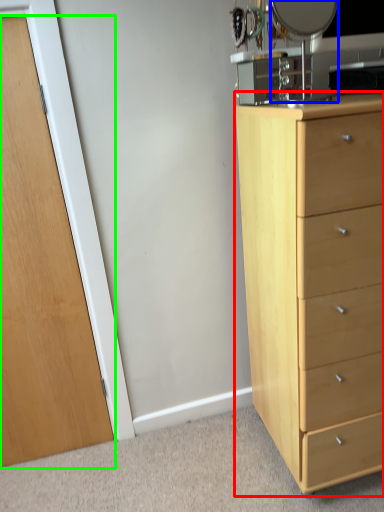
Question: Considering the real-world distances, which object is closest to chest of drawers (highlighted by a red box)? mirror (highlighted by a blue box) or door (highlighted by a green box).

Choices:
 (A) mirror
 (B) door

Answer: (A)